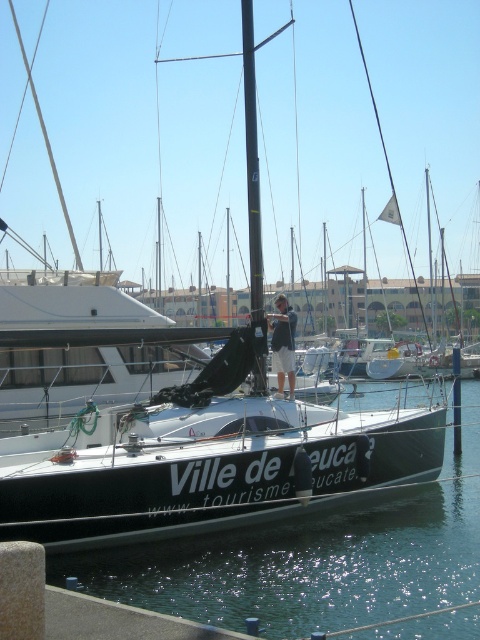
Question: Does clear water at center appear on the left side of dark blue shorts at center?

Choices:
 (A) no
 (B) yes

Answer: (A)

Question: Which point is farther to the camera?

Choices:
 (A) (302, 600)
 (B) (282, 374)

Answer: (B)

Question: Can you confirm if clear water at center is positioned below dark blue shorts at center?

Choices:
 (A) no
 (B) yes

Answer: (B)

Question: Can you confirm if clear water at center is positioned to the left of dark blue shorts at center?

Choices:
 (A) yes
 (B) no

Answer: (B)